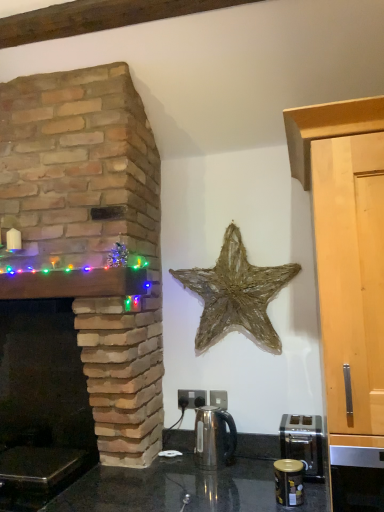
Question: Does satin silver kettle at center have a greater width compared to light wood cabinet at right?

Choices:
 (A) yes
 (B) no

Answer: (B)

Question: Is light wood cabinet at right located within satin silver kettle at center?

Choices:
 (A) yes
 (B) no

Answer: (B)

Question: Does satin silver kettle at center turn towards light wood cabinet at right?

Choices:
 (A) no
 (B) yes

Answer: (A)

Question: From the image's perspective, does satin silver kettle at center appear higher than light wood cabinet at right?

Choices:
 (A) yes
 (B) no

Answer: (B)

Question: Considering the relative positions of satin silver kettle at center and light wood cabinet at right in the image provided, is satin silver kettle at center to the left of light wood cabinet at right from the viewer's perspective?

Choices:
 (A) yes
 (B) no

Answer: (A)

Question: Is satin silver kettle at center with light wood cabinet at right?

Choices:
 (A) yes
 (B) no

Answer: (B)

Question: Is satin silver toaster at lower right, the 2th appliance in the front-to-back sequence, at the left side of natural stone fireplace at left?

Choices:
 (A) yes
 (B) no

Answer: (B)

Question: Is satin silver toaster at lower right, the first appliance from the back, bigger than natural stone fireplace at left?

Choices:
 (A) no
 (B) yes

Answer: (A)

Question: Is satin silver toaster at lower right, the 2th appliance in the front-to-back sequence, not within natural stone fireplace at left?

Choices:
 (A) yes
 (B) no

Answer: (A)

Question: From the image's perspective, is satin silver toaster at lower right, the first appliance from the back, below natural stone fireplace at left?

Choices:
 (A) yes
 (B) no

Answer: (A)

Question: Does satin silver toaster at lower right, the 2th appliance in the front-to-back sequence, have a lesser height compared to natural stone fireplace at left?

Choices:
 (A) no
 (B) yes

Answer: (B)

Question: From a real-world perspective, is satin silver toaster at lower right, the first appliance from the back, located higher than natural stone fireplace at left?

Choices:
 (A) no
 (B) yes

Answer: (A)

Question: Is natural stone fireplace at left behind satin silver kettle at center?

Choices:
 (A) yes
 (B) no

Answer: (B)